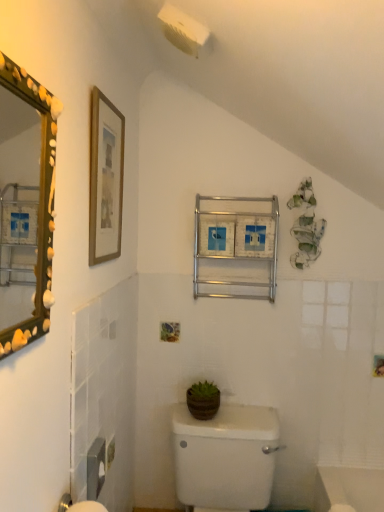
This screenshot has height=512, width=384. I want to click on green matte pot at center, so click(x=203, y=400).

Measure the distance between white glossy toilet at center and camera.

white glossy toilet at center and camera are 5.52 feet apart.

This screenshot has height=512, width=384. Describe the element at coordinates (105, 178) in the screenshot. I see `wooden framed print at upper left` at that location.

You are a GUI agent. You are given a task and a screenshot of the screen. Output one action in this format:
    pyautogui.click(x=<x>, y=<y>)
    Task: Click on the green matte pot at center
    
    Given the screenshot: What is the action you would take?
    click(x=203, y=400)

Which of these two, wooden framed print at upper left or green matte pot at center, stands taller?

Standing taller between the two is wooden framed print at upper left.

From the image's perspective, is wooden framed print at upper left below green matte pot at center?

No.

From a real-world perspective, is wooden framed print at upper left physically above green matte pot at center?

Correct, in the physical world, wooden framed print at upper left is higher than green matte pot at center.

Is wooden framed print at upper left to the left or to the right of green matte pot at center in the image?

Based on their positions, wooden framed print at upper left is located to the left of green matte pot at center.

Is wooden framed print at upper left completely or partially inside green matte pot at center?

No, wooden framed print at upper left is not inside green matte pot at center.

Based on the photo, can you confirm if green matte pot at center is wider than wooden framed print at upper left?

Indeed, green matte pot at center has a greater width compared to wooden framed print at upper left.

Consider the image. From a real-world perspective, is green matte pot at center positioned under metallic silver medicine cabinet at center based on gravity?

Correct, in the physical world, green matte pot at center is lower than metallic silver medicine cabinet at center.

From the image's perspective, which is above, green matte pot at center or metallic silver medicine cabinet at center?

From the image's view, metallic silver medicine cabinet at center is above.

Is green matte pot at center shorter than metallic silver medicine cabinet at center?

Correct, green matte pot at center is not as tall as metallic silver medicine cabinet at center.

Looking at this image, is white glossy toilet at center shorter than metallic silver medicine cabinet at center?

Incorrect, the height of white glossy toilet at center does not fall short of that of metallic silver medicine cabinet at center.

Does white glossy toilet at center have a larger size compared to metallic silver medicine cabinet at center?

Correct, white glossy toilet at center is larger in size than metallic silver medicine cabinet at center.

Is white glossy toilet at center further to camera compared to metallic silver medicine cabinet at center?

No.

Considering the sizes of objects white glossy toilet at center and metallic silver medicine cabinet at center in the image provided, who is wider, white glossy toilet at center or metallic silver medicine cabinet at center?

With larger width is white glossy toilet at center.

Is point (205, 489) behind point (196, 415)?

No, (205, 489) is in front of (196, 415).

Who is bigger, white glossy toilet at center or green matte pot at center?

white glossy toilet at center is bigger.

Could you tell me if white glossy toilet at center is turned towards green matte pot at center?

No, white glossy toilet at center does not turn towards green matte pot at center.

Considering the positions of objects green matte pot at center and white glossy toilet at center in the image provided, who is more to the right, green matte pot at center or white glossy toilet at center?

Positioned to the right is white glossy toilet at center.

Considering the sizes of green matte pot at center and white glossy toilet at center in the image, is green matte pot at center wider or thinner than white glossy toilet at center?

green matte pot at center is thinner than white glossy toilet at center.

Could you tell me if green matte pot at center is facing white glossy toilet at center?

No, green matte pot at center is not aimed at white glossy toilet at center.

Is wooden framed print at upper left in front of or behind metallic silver medicine cabinet at center in the image?

Clearly, wooden framed print at upper left is in front of metallic silver medicine cabinet at center.

Considering the sizes of objects wooden framed print at upper left and metallic silver medicine cabinet at center in the image provided, who is smaller, wooden framed print at upper left or metallic silver medicine cabinet at center?

Smaller between the two is wooden framed print at upper left.

From a real-world perspective, is wooden framed print at upper left under metallic silver medicine cabinet at center?

No, from a real-world perspective, wooden framed print at upper left is not beneath metallic silver medicine cabinet at center.

Which object is wider, wooden framed print at upper left or metallic silver medicine cabinet at center?

Wider between the two is metallic silver medicine cabinet at center.

In order to click on picture frame lying in front of the green matte pot at center in this screenshot , I will do `click(105, 178)`.

The image size is (384, 512). I want to click on plant that is below the wooden framed print at upper left (from the image's perspective), so click(203, 400).

When comparing their distances from wooden framed print at upper left, does metallic silver medicine cabinet at center or green matte pot at center seem closer?

metallic silver medicine cabinet at center is closer to wooden framed print at upper left.

From the image, which object appears to be farther from wooden framed print at upper left, white glossy toilet at center or green matte pot at center?

white glossy toilet at center is further to wooden framed print at upper left.

Which object lies further to the anchor point wooden framed print at upper left, metallic silver medicine cabinet at center or white glossy toilet at center?

white glossy toilet at center is positioned further to the anchor wooden framed print at upper left.

Based on the photo, looking at the image, which one is located further to white glossy toilet at center, green matte pot at center or wooden framed print at upper left?

Based on the image, wooden framed print at upper left appears to be further to white glossy toilet at center.

When comparing their distances from wooden framed print at upper left, does white glossy toilet at center or metallic silver medicine cabinet at center seem further?

white glossy toilet at center.

Looking at the image, which one is located closer to white glossy toilet at center, metallic silver medicine cabinet at center or green matte pot at center?

The object closer to white glossy toilet at center is green matte pot at center.

Estimate the real-world distances between objects in this image. Which object is further from metallic silver medicine cabinet at center, wooden framed print at upper left or white glossy toilet at center?

white glossy toilet at center.

From the image, which object appears to be farther from green matte pot at center, metallic silver medicine cabinet at center or wooden framed print at upper left?

wooden framed print at upper left lies further to green matte pot at center than the other object.

Locate an element on the screen. plant between metallic silver medicine cabinet at center and white glossy toilet at center vertically is located at coordinates (203, 400).

At what (x,y) coordinates should I click in order to perform the action: click on plant between wooden framed print at upper left and white glossy toilet at center vertically. Please return your answer as a coordinate pair (x, y). The image size is (384, 512). Looking at the image, I should click on (203, 400).

Image resolution: width=384 pixels, height=512 pixels. Identify the location of medicine cabinet between wooden framed print at upper left and white glossy toilet at center vertically. pos(236,247).

Identify the location of medicine cabinet between wooden framed print at upper left and green matte pot at center in the vertical direction. This screenshot has height=512, width=384. (236, 247).